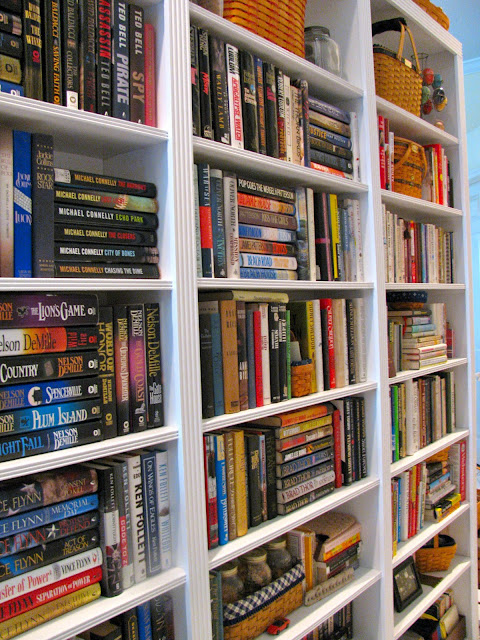
Find the location of a particular element. This screenshot has width=480, height=640. wicker baskets is located at coordinates (275, 15), (398, 84), (443, 17), (409, 157), (281, 602), (437, 557).